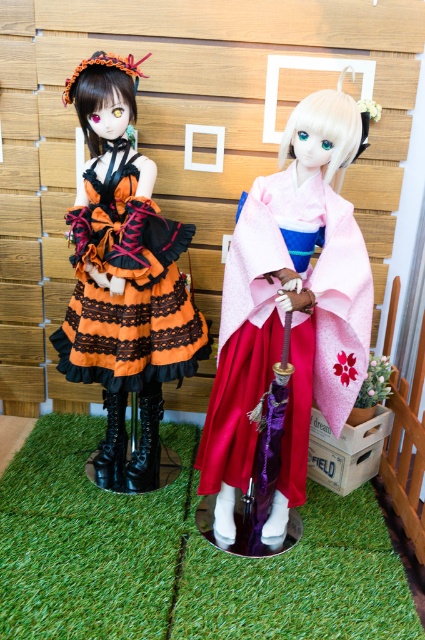
Who is positioned more to the right, pink satin kimono at center or orange satin dress at left?

pink satin kimono at center is more to the right.

Consider the image. Is pink satin kimono at center above orange satin dress at left?

No.

Is point (351, 326) farther from camera compared to point (142, 259)?

No.

The width and height of the screenshot is (425, 640). Find the location of `pink satin kimono at center`. pink satin kimono at center is located at coordinates (289, 308).